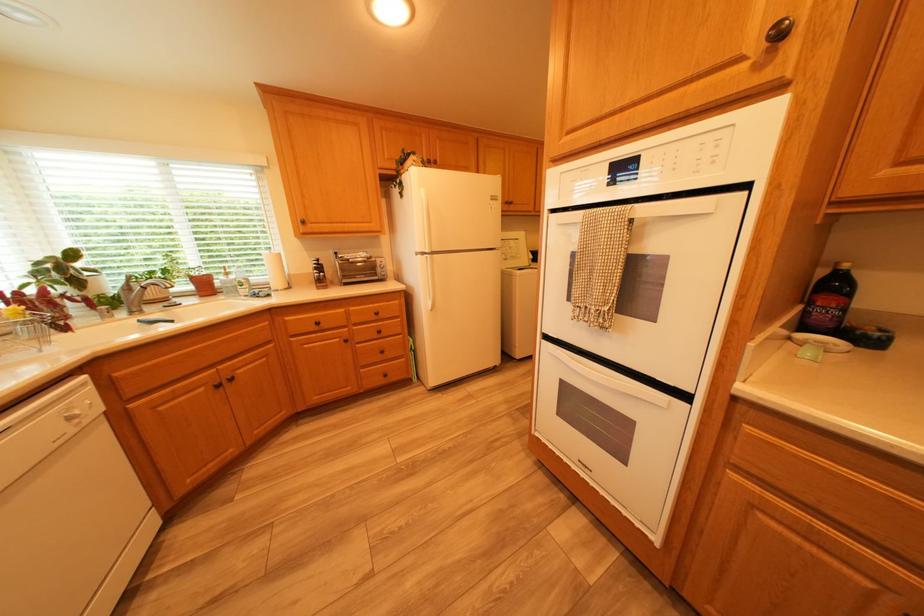
What do you see at coordinates (686, 158) in the screenshot? This screenshot has width=924, height=616. I see `a oven control button` at bounding box center [686, 158].